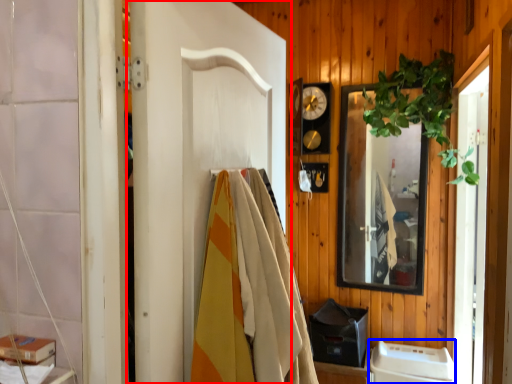
Question: Which object appears closest to the camera in this image, door (highlighted by a red box) or appliance (highlighted by a blue box)?

Choices:
 (A) door
 (B) appliance

Answer: (A)